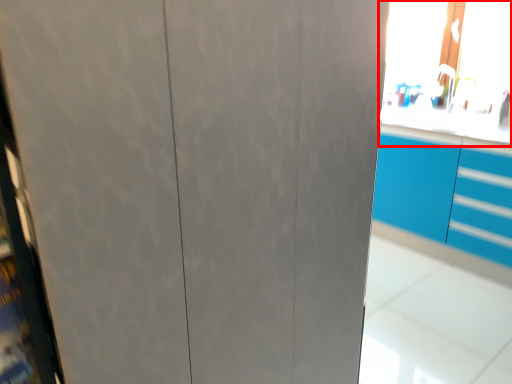
Question: Where is window screen (annotated by the red box) located in relation to cabinetry in the image?

Choices:
 (A) left
 (B) right

Answer: (B)